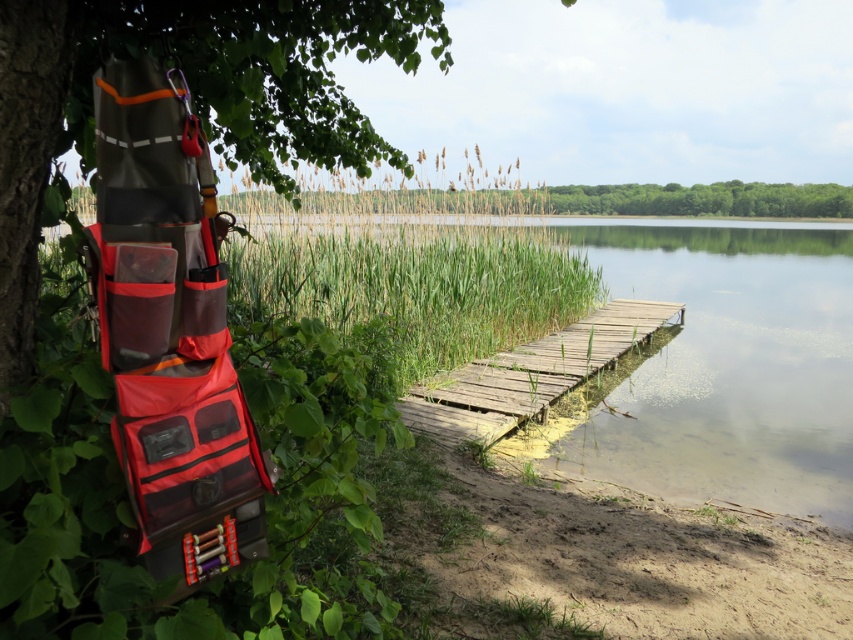
You are planning to walk across the wooden dock at center. Considering its width relative to the green leafy tree at upper center, do you think it is safe for someone with a fear of narrow spaces?

The wooden dock at center has a lesser width compared to the green leafy tree at upper center. Since the dock is narrower, it might not be safe for someone with a fear of narrow spaces due to its reduced width.

You are a hiker who just arrived at the lakeside and noticed an orange fabric bag at left and green grassy reed at center. Which object is taller?

The orange fabric bag at left is taller than the green grassy reed at center.